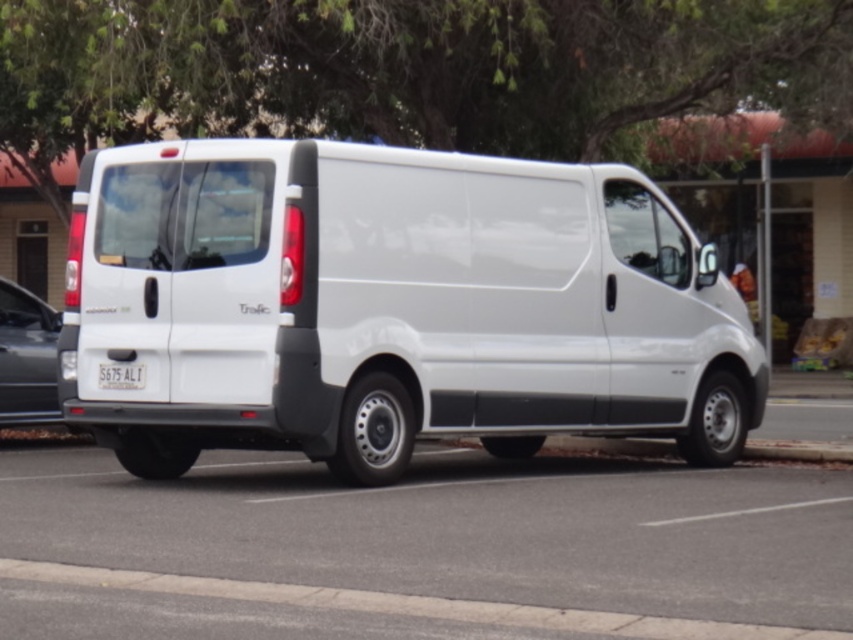
Is point (13, 381) farther from viewer compared to point (125, 385)?

Yes, it is.

Which is behind, point (15, 323) or point (102, 384)?

Positioned behind is point (15, 323).

Identify the location of matte black car at left. (27, 358).

Can you confirm if concrete at lower center is positioned below white plastic license plate at center?

Correct, concrete at lower center is located below white plastic license plate at center.

Is point (820, 454) positioned after point (142, 387)?

Yes, point (820, 454) is farther from viewer.

What do you see at coordinates (610, 445) in the screenshot?
I see `concrete at lower center` at bounding box center [610, 445].

Locate an element on the screen. The width and height of the screenshot is (853, 640). concrete at lower center is located at coordinates (610, 445).

Can you confirm if white matte van at center is positioned to the left of matte black car at left?

No, white matte van at center is not to the left of matte black car at left.

Which is behind, point (590, 259) or point (56, 406)?

Point (56, 406)

Identify the location of white matte van at center. (392, 307).